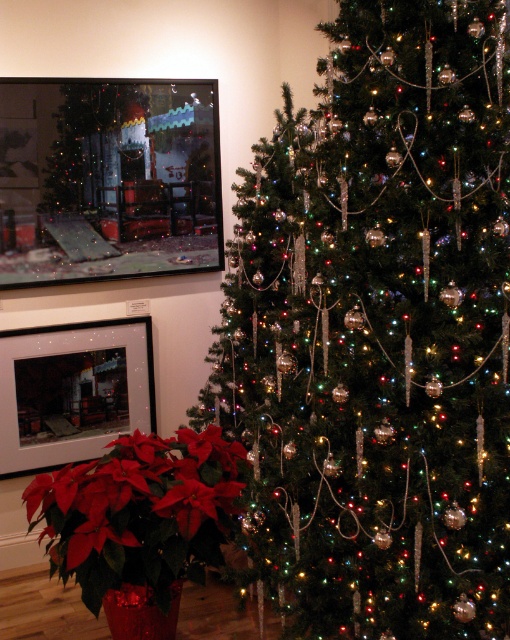
You are a guest at a Christmas party and want to take a photo with both the shiny metallic tree at center and the red matte poinsettia at lower left. Where should you stand to ensure both objects are in your camera frame?

You should stand to the left of the shiny metallic tree at center and the red matte poinsettia at lower left so that both objects are visible in the frame since the shiny metallic tree at center is to the right of the red matte poinsettia at lower left.

You are a guest at a Christmas party and want to take a photo of the shiny metallic tree at center and the red matte poinsettia at lower left. Which object should you focus on first if you want both to be in sharp focus?

The shiny metallic tree at center is positioned over the red matte poinsettia at lower left, so focusing on the tree will ensure both are in sharp focus since it is closer to the camera.

You are planning to place a new decoration that is 24 inches wide between the shiny metallic tree at center and the red matte poinsettia at lower left. Will there be enough space?

The distance between the shiny metallic tree at center and the red matte poinsettia at lower left is 23.67 inches, which is slightly less than the decoration width of 24 inches. Therefore, there is not enough space to place the decoration between them.